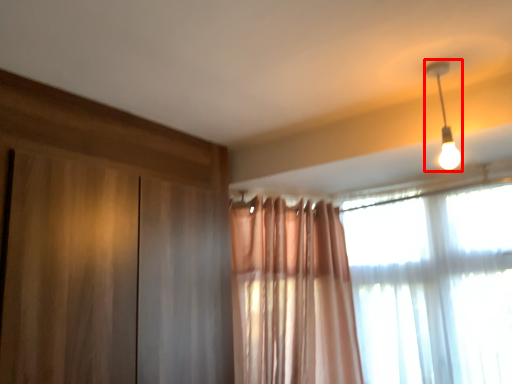
Question: In this image, where is lamp (annotated by the red box) located relative to window?

Choices:
 (A) right
 (B) left

Answer: (B)